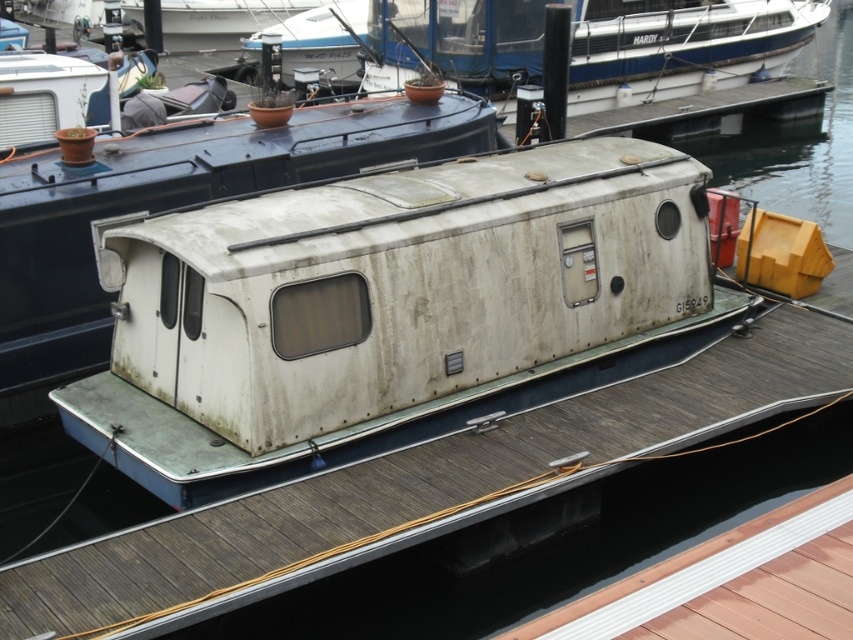
Question: Does white matte boat at center appear over white matte cabin at center?

Choices:
 (A) yes
 (B) no

Answer: (B)

Question: Considering the relative positions of white matte boat at center and white matte deck at center in the image provided, where is white matte boat at center located with respect to white matte deck at center?

Choices:
 (A) right
 (B) left

Answer: (B)

Question: Estimate the real-world distances between objects in this image. Which object is farther from the white matte boat at center?

Choices:
 (A) white matte cabin at center
 (B) white matte boat at upper center

Answer: (B)

Question: Considering the real-world distances, which object is farthest from the white matte cabin at center?

Choices:
 (A) white matte boat at upper center
 (B) white matte boat at center

Answer: (A)

Question: Is white matte boat at center to the right of white matte deck at center from the viewer's perspective?

Choices:
 (A) no
 (B) yes

Answer: (A)

Question: Which object is farther from the camera taking this photo?

Choices:
 (A) white matte cabin at center
 (B) white matte deck at center
 (C) white matte boat at center

Answer: (A)